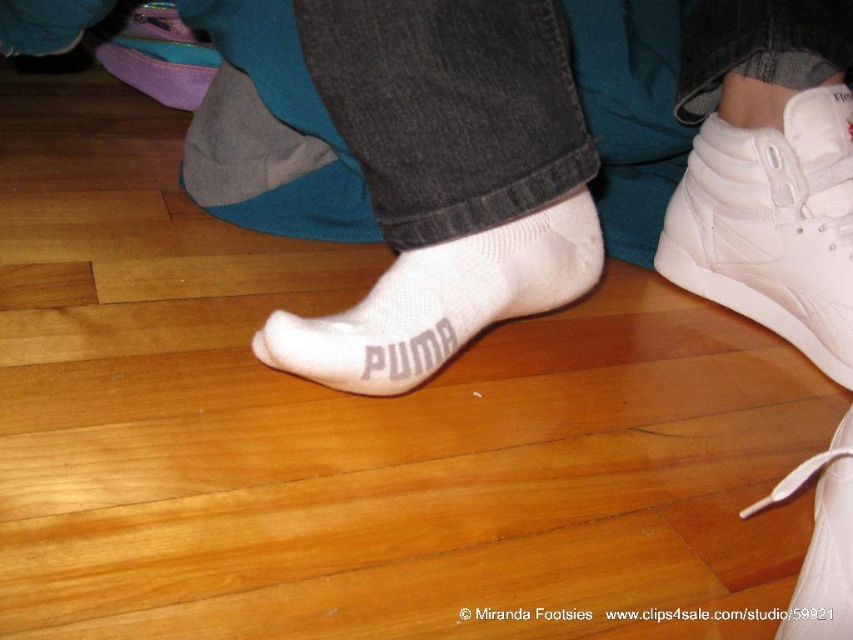
Between white leather sneaker at right and white knit sock at center, which one has less height?

white knit sock at center is shorter.

Does point (846, 193) lie behind point (375, 308)?

Yes.

The width and height of the screenshot is (853, 640). Find the location of `white leather sneaker at right`. white leather sneaker at right is located at coordinates (772, 225).

Which is more to the right, white fabric socks at center or white leather sneaker at right?

Positioned to the right is white leather sneaker at right.

Can you confirm if white fabric socks at center is shorter than white leather sneaker at right?

No, white fabric socks at center is not shorter than white leather sneaker at right.

This screenshot has height=640, width=853. I want to click on white fabric socks at center, so (x=543, y=160).

Does white fabric socks at center have a larger size compared to white leather shoe at lower right?

Indeed, white fabric socks at center has a larger size compared to white leather shoe at lower right.

The image size is (853, 640). What do you see at coordinates (543, 160) in the screenshot?
I see `white fabric socks at center` at bounding box center [543, 160].

Where is `white fabric socks at center`? white fabric socks at center is located at coordinates (543, 160).